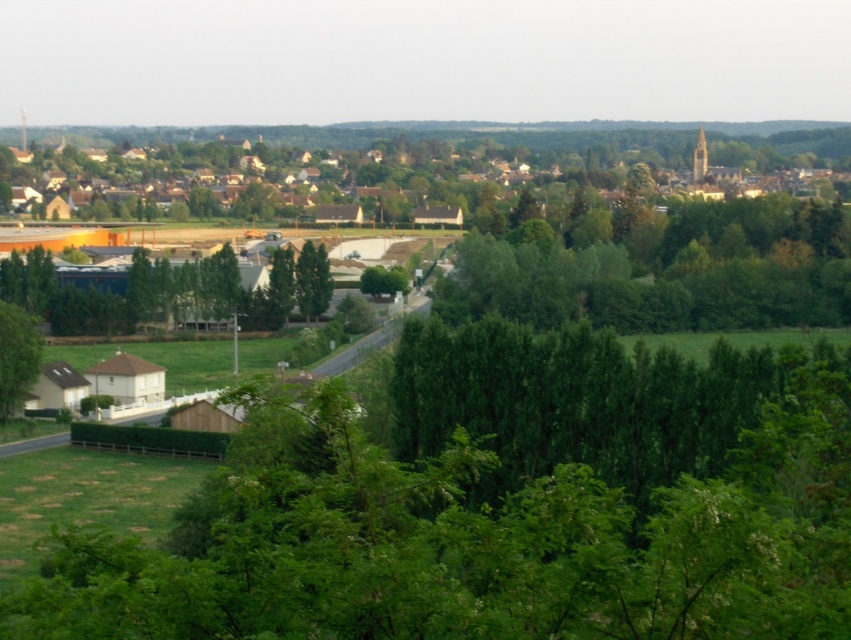
You are standing at the center of the road and see the green leafy tree at lower center and the green leafy tree at lower left. Which tree is closer to your left side?

The green leafy tree at lower left is closer to your left side because it is positioned to the left of the green leafy tree at lower center.

You are standing at the center of the road in the image and want to walk to the green leafy tree at lower center. According to the coordinates provided, in which direction should you head?

The green leafy tree at lower center is located at point (497, 504), which means you should head towards the lower center direction from your current position at the center of the road.

You are planning to plant new trees in the green leafy trees at center area. Considering the space between them and the brown wooden houses at upper center, will the trees grow wide enough to reach the houses?

The green leafy trees at center are currently narrower than the brown wooden houses at upper center. However, since trees can grow wider over time, it is possible that they might eventually reach the houses if not pruned properly.